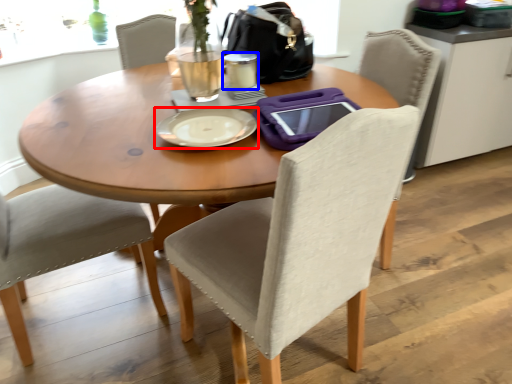
Question: Which of the following is the closest to the observer, plate (highlighted by a red box) or coffee cup (highlighted by a blue box)?

Choices:
 (A) plate
 (B) coffee cup

Answer: (A)